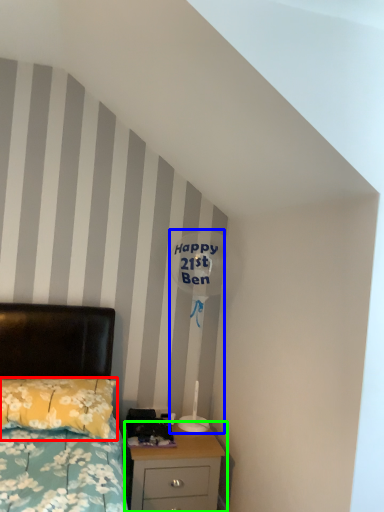
Question: Which is nearer to the pillow (highlighted by a red box)? table lamp (highlighted by a blue box) or nightstand (highlighted by a green box).

Choices:
 (A) table lamp
 (B) nightstand

Answer: (B)